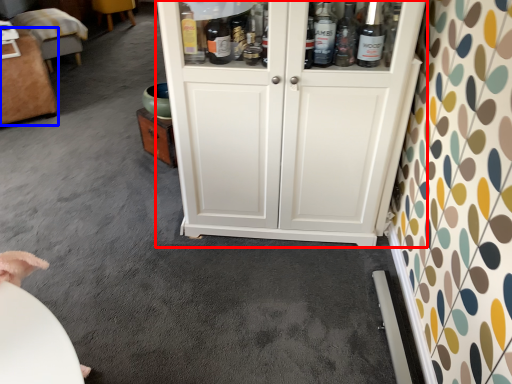
Question: Which object appears farthest to the camera in this image, cupboard (highlighted by a red box) or furniture (highlighted by a blue box)?

Choices:
 (A) cupboard
 (B) furniture

Answer: (B)